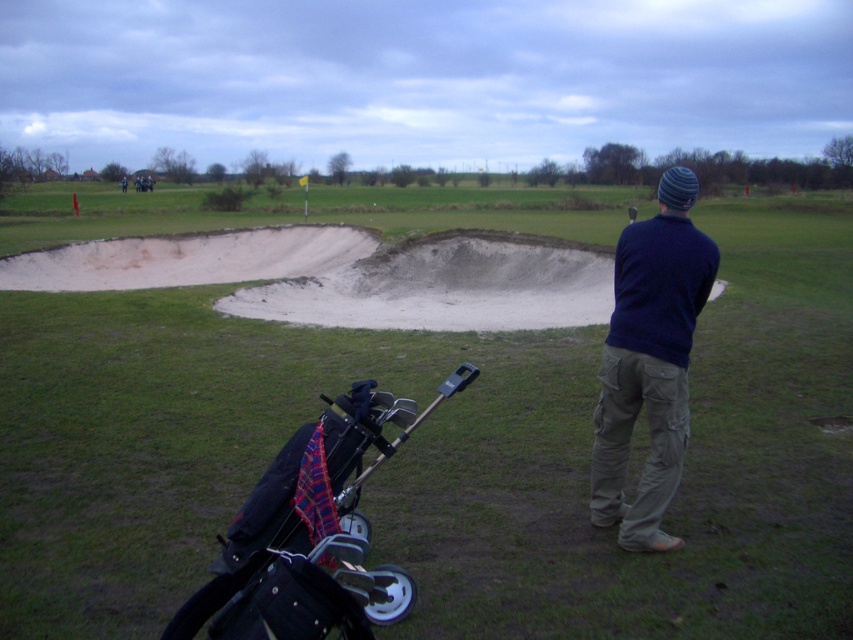
Question: Which point is closer to the camera taking this photo?

Choices:
 (A) pyautogui.click(x=439, y=445)
 (B) pyautogui.click(x=685, y=298)

Answer: (B)

Question: Does sandymaterial/texturebunker at center have a larger size compared to dark blue sweater at center?

Choices:
 (A) yes
 (B) no

Answer: (A)

Question: Considering the relative positions of sandymaterial/texturebunker at center and dark blue sweater at center in the image provided, where is sandymaterial/texturebunker at center located with respect to dark blue sweater at center?

Choices:
 (A) above
 (B) below

Answer: (A)

Question: Which point is farther from the camera taking this photo?

Choices:
 (A) (772, 406)
 (B) (610, 465)

Answer: (A)

Question: Can you confirm if sandymaterial/texturebunker at center is bigger than dark blue sweater at center?

Choices:
 (A) yes
 (B) no

Answer: (A)